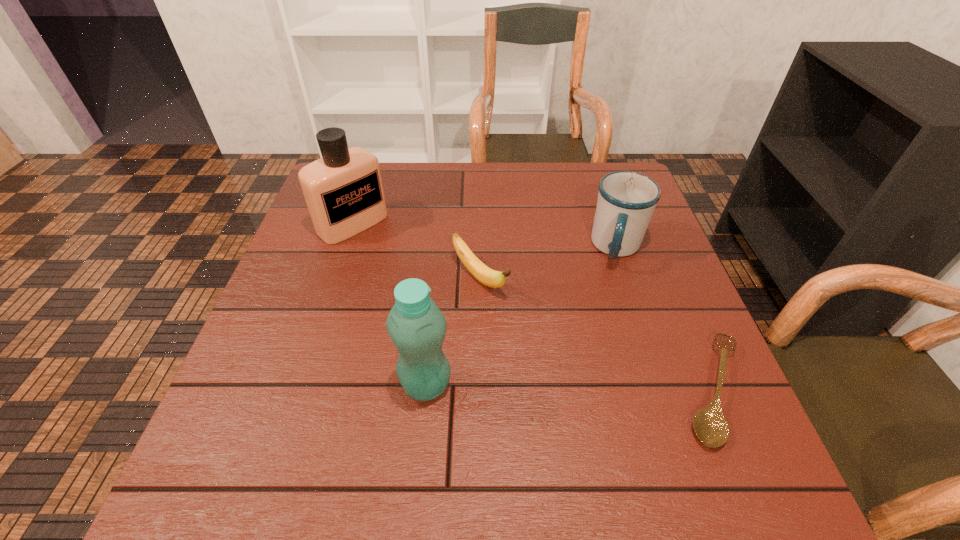
Identify the location of free point located on the handle side of the mug. This screenshot has height=540, width=960. (610, 386).

Identify the location of vacant area situated 0.140m on the handle side of the mug. This screenshot has width=960, height=540. (614, 318).

This screenshot has height=540, width=960. In order to click on free space located 0.160m on the handle side of the mug in this screenshot , I will do `click(614, 325)`.

This screenshot has height=540, width=960. In order to click on vacant area located 0.050m at the stem of the fourth tallest object in this screenshot , I will do `click(514, 311)`.

You are a GUI agent. You are given a task and a screenshot of the screen. Output one action in this format:
    pyautogui.click(x=<x>, y=<y>)
    Task: Click on the vacant space located 0.280m at the stem of the fourth tallest object
    
    Given the screenshot: What is the action you would take?
    pyautogui.click(x=597, y=383)

Locate an element on the screen. Image resolution: width=960 pixels, height=540 pixels. vacant space located 0.330m at the stem of the fourth tallest object is located at coordinates (618, 402).

The width and height of the screenshot is (960, 540). I want to click on object located in the far edge section of the desktop, so click(343, 190).

The image size is (960, 540). I want to click on water bottle at the near edge, so click(417, 327).

Identify the location of ladle located in the near edge section of the desktop. Image resolution: width=960 pixels, height=540 pixels. (710, 425).

You are a GUI agent. You are given a task and a screenshot of the screen. Output one action in this format:
    pyautogui.click(x=<x>, y=<y>)
    Task: Click on the object that is at the left edge
    The height and width of the screenshot is (540, 960).
    Given the screenshot: What is the action you would take?
    click(x=343, y=190)